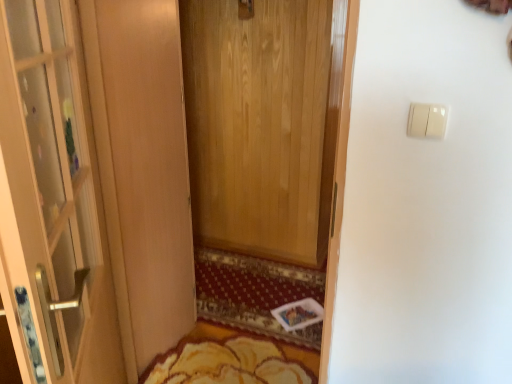
Question: Is yellow floral rug at lower center taller or shorter than white plastic light switch at upper right?

Choices:
 (A) short
 (B) tall

Answer: (A)

Question: In terms of width, does yellow floral rug at lower center look wider or thinner when compared to white plastic light switch at upper right?

Choices:
 (A) thin
 (B) wide

Answer: (B)

Question: Considering the real-world distances, which object is farthest from the white plastic light switch at upper right?

Choices:
 (A) yellow textured rug at center
 (B) matte glass door at left
 (C) yellow floral rug at lower center

Answer: (A)

Question: Which object is positioned farthest from the yellow textured rug at center?

Choices:
 (A) yellow floral rug at lower center
 (B) white plastic light switch at upper right
 (C) matte glass door at left

Answer: (B)